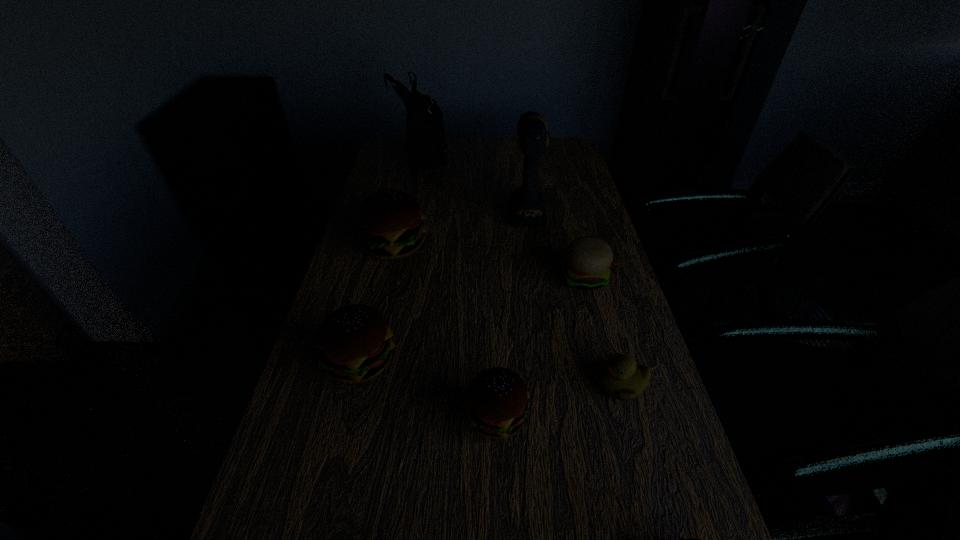
I want to click on vacant space located at the beak of the duckling, so click(486, 384).

You are a GUI agent. You are given a task and a screenshot of the screen. Output one action in this format:
    pyautogui.click(x=<x>, y=<y>)
    Task: Click on the vacant space located at the beak of the duckling
    
    Given the screenshot: What is the action you would take?
    pyautogui.click(x=517, y=384)

I want to click on object that is at the far edge, so click(425, 135).

This screenshot has width=960, height=540. I want to click on shoulder bag positioned at the left edge, so click(425, 135).

Find the location of a particular element. This screenshot has height=540, width=960. hamburger present at the right edge is located at coordinates (588, 259).

Find the location of a particular element. duckling located at the right edge is located at coordinates (621, 378).

At what (x,y) coordinates should I click in order to perform the action: click on object that is at the far left corner. Please return your answer as a coordinate pair (x, y). This screenshot has height=540, width=960. Looking at the image, I should click on (425, 135).

Find the location of a particular element. The width and height of the screenshot is (960, 540). free space at the far edge of the desktop is located at coordinates (524, 162).

In the image, there is a desktop. Where is `blank space at the left edge`? This screenshot has height=540, width=960. blank space at the left edge is located at coordinates (350, 286).

Identify the location of vacant area between the duckling and the beige hamburger. The height and width of the screenshot is (540, 960). (603, 331).